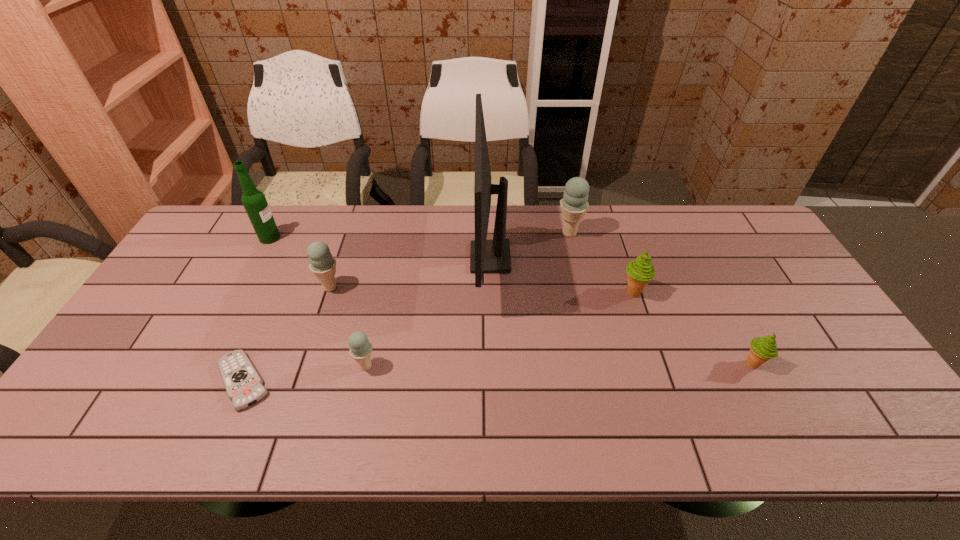
At what (x,y) coordinates should I click in order to perform the action: click on free space at the far edge of the desktop. Please return your answer as a coordinate pair (x, y). Looking at the image, I should click on (373, 211).

At what (x,y) coordinates should I click in order to perform the action: click on vacant space at the near edge of the desktop. Please return your answer as a coordinate pair (x, y). This screenshot has width=960, height=540. Looking at the image, I should click on (281, 438).

Find the location of `free region at the far left corner of the desktop`. free region at the far left corner of the desktop is located at coordinates (214, 228).

In the image, there is a desktop. At what (x,y) coordinates should I click in order to perform the action: click on vacant space at the far right corner. Please return your answer as a coordinate pair (x, y). The width and height of the screenshot is (960, 540). Looking at the image, I should click on (715, 223).

Locate an element on the screen. empty space that is in between the fifth object from right to left and the nearer green icecream is located at coordinates (560, 365).

You are a GUI agent. You are given a task and a screenshot of the screen. Output one action in this format:
    pyautogui.click(x=<x>, y=<y>)
    Task: Click on the vacant space that's between the leftmost icecream and the biggest blue ice cream
    The image size is (960, 540).
    Given the screenshot: What is the action you would take?
    pyautogui.click(x=450, y=260)

The image size is (960, 540). I want to click on vacant area that lies between the rightmost blue ice cream and the nearer green icecream, so click(x=660, y=299).

I want to click on free space between the leftmost blue ice cream and the green beer bottle, so click(x=300, y=262).

You are a GUI agent. You are given a task and a screenshot of the screen. Output one action in this format:
    pyautogui.click(x=<x>, y=<y>)
    Task: Click on the vacant space that's between the second nearest blue ice cream and the second object from right to left
    
    Given the screenshot: What is the action you would take?
    pyautogui.click(x=482, y=290)

This screenshot has height=540, width=960. Identify the location of free space between the smaller green icecream and the second biggest blue ice cream. (541, 326).